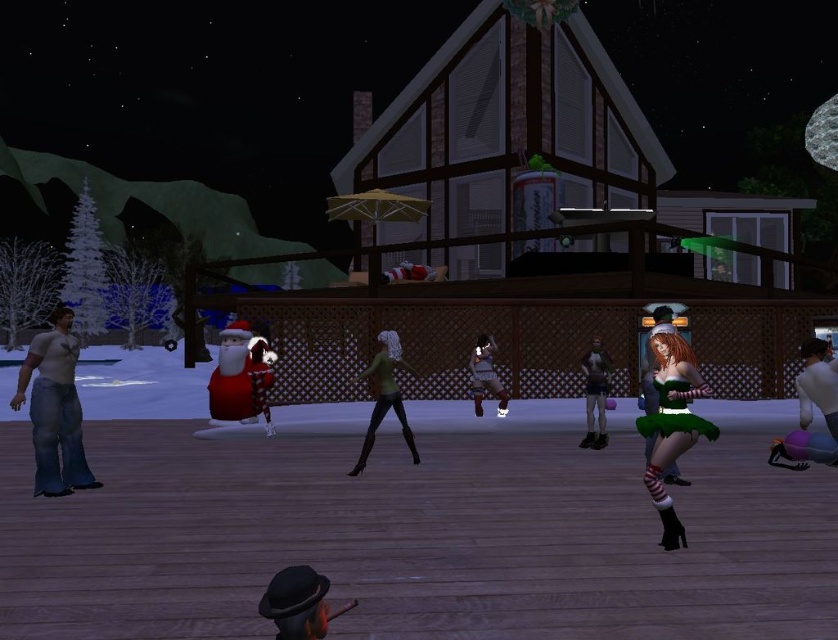
Between jeans at left and green satin dress at right, which one appears on the right side from the viewer's perspective?

green satin dress at right

Image resolution: width=838 pixels, height=640 pixels. I want to click on jeans at left, so click(54, 410).

Locate an element on the screen. This screenshot has height=640, width=838. jeans at left is located at coordinates (54, 410).

Is black felt hat at lower center taller than multicolored plush at lower right?

Incorrect, black felt hat at lower center's height is not larger of multicolored plush at lower right's.

Consider the image. Can you confirm if black felt hat at lower center is positioned above multicolored plush at lower right?

No, black felt hat at lower center is not above multicolored plush at lower right.

Does point (319, 627) come farther from viewer compared to point (816, 342)?

No, (319, 627) is in front of (816, 342).

The width and height of the screenshot is (838, 640). I want to click on black felt hat at lower center, so click(x=295, y=602).

Based on the photo, who is more distant from viewer, (595, 337) or (642, 390)?

The point (595, 337) is behind.

How distant is metallic silver tank top at center from green satin dress at center?

A distance of 34.98 inches exists between metallic silver tank top at center and green satin dress at center.

Is point (591, 412) in front of point (650, 305)?

That is True.

Identify the location of metallic silver tank top at center. The width and height of the screenshot is (838, 640). (595, 394).